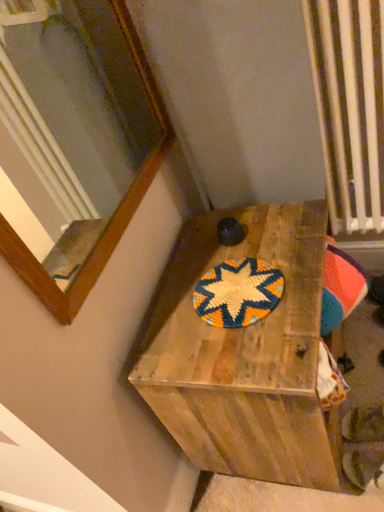
Locate an element on the screen. The height and width of the screenshot is (512, 384). free point above wooden box at center (from a real-world perspective) is located at coordinates (239, 280).